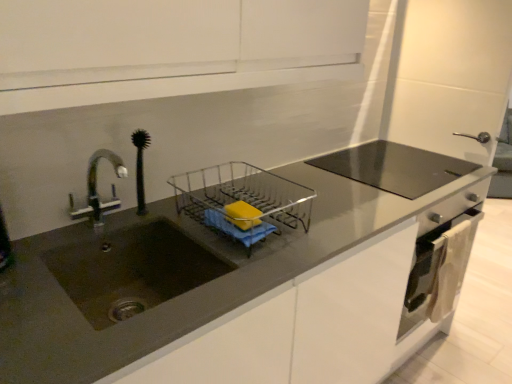
Describe the element at coordinates (127, 260) in the screenshot. The image size is (512, 384). I see `matte dark brown sink at left` at that location.

Locate an element on the screen. This screenshot has width=512, height=384. matte gray countertop at center is located at coordinates (238, 283).

The image size is (512, 384). What do you see at coordinates (242, 198) in the screenshot?
I see `clear plastic dish rack at center` at bounding box center [242, 198].

Describe the element at coordinates (438, 269) in the screenshot. I see `satin silver oven at lower right` at that location.

Identify the location of yellow matte soap at center. The image size is (512, 384). (242, 215).

Which object is positioned more to the left, matte dark brown sink at left or clear plastic dish rack at center?

Positioned to the left is matte dark brown sink at left.

Considering the sizes of objects matte dark brown sink at left and clear plastic dish rack at center in the image provided, who is wider, matte dark brown sink at left or clear plastic dish rack at center?

Wider between the two is matte dark brown sink at left.

Is matte dark brown sink at left oriented towards clear plastic dish rack at center?

No, matte dark brown sink at left is not aimed at clear plastic dish rack at center.

Does matte dark brown sink at left have a smaller size compared to clear plastic dish rack at center?

Actually, matte dark brown sink at left might be larger than clear plastic dish rack at center.

Considering the relative positions of matte gray countertop at center and matte dark brown sink at left in the image provided, is matte gray countertop at center in front of matte dark brown sink at left?

Yes.

Is point (315, 243) farther from camera compared to point (159, 252)?

No, it is not.

Considering the positions of objects matte gray countertop at center and matte dark brown sink at left in the image provided, who is more to the right, matte gray countertop at center or matte dark brown sink at left?

From the viewer's perspective, matte gray countertop at center appears more on the right side.

Considering the positions of objects matte dark brown sink at left and satin silver oven at lower right in the image provided, who is more to the left, matte dark brown sink at left or satin silver oven at lower right?

matte dark brown sink at left.

Is satin silver oven at lower right completely or partially inside matte dark brown sink at left?

That's incorrect, satin silver oven at lower right is not inside matte dark brown sink at left.

Identify the location of oven located on the right of matte dark brown sink at left. (438, 269).

Which is behind, matte dark brown sink at left or satin silver oven at lower right?

satin silver oven at lower right is further away from the camera.

Is clear plastic dish rack at center not close to matte gray countertop at center?

They are positioned close to each other.

Looking at this image, is matte gray countertop at center completely or partially inside clear plastic dish rack at center?

No, clear plastic dish rack at center does not contain matte gray countertop at center.

Who is shorter, clear plastic dish rack at center or matte gray countertop at center?

Standing shorter between the two is clear plastic dish rack at center.

Is clear plastic dish rack at center aimed at matte gray countertop at center?

No, clear plastic dish rack at center is not facing towards matte gray countertop at center.

Can you tell me how much clear plastic dish rack at center and matte dark brown sink at left differ in facing direction?

1.12 degrees separate the facing orientations of clear plastic dish rack at center and matte dark brown sink at left.

From a real-world perspective, is clear plastic dish rack at center located beneath matte dark brown sink at left?

No, from a real-world perspective, clear plastic dish rack at center is not beneath matte dark brown sink at left.

Does clear plastic dish rack at center have a greater width compared to matte dark brown sink at left?

No.

Which is behind, point (278, 194) or point (97, 159)?

The point (278, 194) is farther.

From a real-world perspective, who is located higher, matte dark brown sink at left or yellow matte soap at center?

yellow matte soap at center is physically above.

The width and height of the screenshot is (512, 384). I want to click on sink lying below the yellow matte soap at center (from the image's perspective), so click(127, 260).

Does matte dark brown sink at left appear on the left side of yellow matte soap at center?

Yes, matte dark brown sink at left is to the left of yellow matte soap at center.

Is matte dark brown sink at left facing away from yellow matte soap at center?

No, matte dark brown sink at left is not facing the opposite direction of yellow matte soap at center.

From their relative heights in the image, would you say satin silver oven at lower right is taller or shorter than matte dark brown sink at left?

In the image, satin silver oven at lower right appears to be taller than matte dark brown sink at left.

Which object is closer to the camera taking this photo, satin silver oven at lower right or matte dark brown sink at left?

matte dark brown sink at left is more forward.

Is matte dark brown sink at left at the back of satin silver oven at lower right?

satin silver oven at lower right does not have its back to matte dark brown sink at left.

The height and width of the screenshot is (384, 512). I want to click on appliance above the matte dark brown sink at left (from the image's perspective), so click(242, 198).

The height and width of the screenshot is (384, 512). In order to click on sink that appears on the left of matte gray countertop at center in this screenshot , I will do [x=127, y=260].

Looking at the image, which one is located further to yellow matte soap at center, matte gray countertop at center or satin silver oven at lower right?

Based on the image, satin silver oven at lower right appears to be further to yellow matte soap at center.

From the image, which object appears to be nearer to yellow matte soap at center, clear plastic dish rack at center or matte dark brown sink at left?

Based on the image, clear plastic dish rack at center appears to be nearer to yellow matte soap at center.

When comparing their distances from clear plastic dish rack at center, does matte dark brown sink at left or satin silver oven at lower right seem closer?

Among the two, matte dark brown sink at left is located nearer to clear plastic dish rack at center.

Which object lies nearer to the anchor point satin silver oven at lower right, yellow matte soap at center or clear plastic dish rack at center?

clear plastic dish rack at center.

Estimate the real-world distances between objects in this image. Which object is closer to matte dark brown sink at left, yellow matte soap at center or clear plastic dish rack at center?

clear plastic dish rack at center lies closer to matte dark brown sink at left than the other object.

Considering their positions, is clear plastic dish rack at center positioned closer to satin silver oven at lower right than matte dark brown sink at left?

The object closer to satin silver oven at lower right is clear plastic dish rack at center.

Estimate the real-world distances between objects in this image. Which object is closer to clear plastic dish rack at center, matte dark brown sink at left or yellow matte soap at center?

The object closer to clear plastic dish rack at center is yellow matte soap at center.

Consider the image. Based on their spatial positions, is yellow matte soap at center or matte dark brown sink at left closer to clear plastic dish rack at center?

yellow matte soap at center is positioned closer to the anchor clear plastic dish rack at center.

You are a GUI agent. You are given a task and a screenshot of the screen. Output one action in this format:
    pyautogui.click(x=<x>, y=<y>)
    Task: Click on the countertop between matte dark brown sink at left and satin silver oven at lower right in the horizontal direction
    Image resolution: width=512 pixels, height=384 pixels.
    Given the screenshot: What is the action you would take?
    pos(238,283)

I want to click on appliance between matte dark brown sink at left and satin silver oven at lower right, so click(242, 198).

Find the location of `appliance between matte gray countertop at center and satin silver oven at lower right along the z-axis`. appliance between matte gray countertop at center and satin silver oven at lower right along the z-axis is located at coordinates (242, 198).

What are the coordinates of `soap located between matte dark brown sink at left and satin silver oven at lower right in the left-right direction` in the screenshot? It's located at (242, 215).